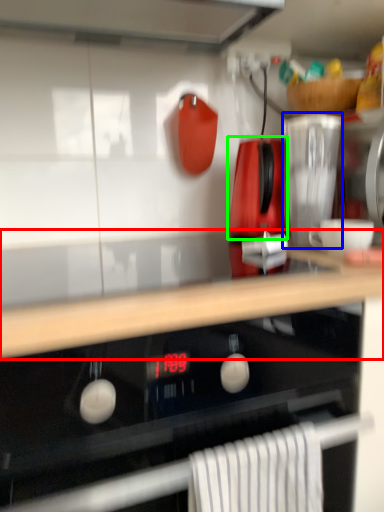
Question: Considering the real-world distances, which object is farthest from countertop (highlighted by a red box)? kitchen appliance (highlighted by a blue box) or kitchen appliance (highlighted by a green box)?

Choices:
 (A) kitchen appliance
 (B) kitchen appliance

Answer: (B)